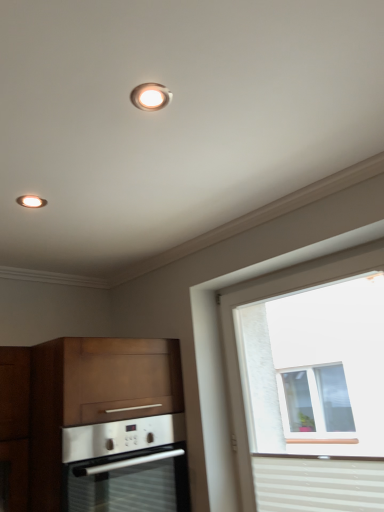
This screenshot has width=384, height=512. In order to click on satin silver oven at lower left in this screenshot , I will do `click(127, 465)`.

The height and width of the screenshot is (512, 384). Describe the element at coordinates (94, 425) in the screenshot. I see `wooden cabinet at lower left` at that location.

Identify the location of white striped curtain at lower right. (318, 483).

The width and height of the screenshot is (384, 512). I want to click on satin silver oven at lower left, so click(x=127, y=465).

Considering the relative positions of satin silver oven at lower left and matte white recessed light at upper center in the image provided, is satin silver oven at lower left to the right of matte white recessed light at upper center from the viewer's perspective?

In fact, satin silver oven at lower left is to the left of matte white recessed light at upper center.

Looking at the image, does satin silver oven at lower left seem bigger or smaller compared to matte white recessed light at upper center?

satin silver oven at lower left is bigger than matte white recessed light at upper center.

Is satin silver oven at lower left completely or partially outside of matte white recessed light at upper center?

That's correct, satin silver oven at lower left is outside of matte white recessed light at upper center.

Which object is further away from the camera, white striped curtain at lower right or matte white recessed light at upper center?

white striped curtain at lower right is further from the camera.

Is white striped curtain at lower right aimed at matte white recessed light at upper center?

No, white striped curtain at lower right does not turn towards matte white recessed light at upper center.

You are a GUI agent. You are given a task and a screenshot of the screen. Output one action in this format:
    pyautogui.click(x=<x>, y=<y>)
    Task: Click on the lighting on the left of white striped curtain at lower right
    
    Given the screenshot: What is the action you would take?
    pyautogui.click(x=150, y=96)

Which is more distant, (313, 458) or (139, 103)?

The point (313, 458) is farther.

Can you confirm if wooden cabinet at lower left is shorter than white striped curtain at lower right?

No, wooden cabinet at lower left is not shorter than white striped curtain at lower right.

Can you confirm if wooden cabinet at lower left is wider than white striped curtain at lower right?

Yes.

In the image, is wooden cabinet at lower left positioned in front of or behind white striped curtain at lower right?

Clearly, wooden cabinet at lower left is in front of white striped curtain at lower right.

Does white textured window at right touch white striped curtain at lower right?

white textured window at right and white striped curtain at lower right are not in contact.

Looking at this image, considering the relative positions of white textured window at right and white striped curtain at lower right in the image provided, is white textured window at right to the left or to the right of white striped curtain at lower right?

white textured window at right is to the right of white striped curtain at lower right.

The image size is (384, 512). What are the coordinates of `window above the white striped curtain at lower right (from a real-world perspective)` in the screenshot? It's located at (300, 355).

Which of these two, white textured window at right or white striped curtain at lower right, is wider?

Wider between the two is white textured window at right.

Does point (146, 96) appear closer or farther from the camera than point (270, 327)?

Point (146, 96) is positioned closer to the camera compared to point (270, 327).

Considering the relative sizes of matte white recessed light at upper center and white textured window at right in the image provided, is matte white recessed light at upper center wider than white textured window at right?

In fact, matte white recessed light at upper center might be narrower than white textured window at right.

From the image's perspective, which is above, matte white recessed light at upper center or white textured window at right?

matte white recessed light at upper center appears higher in the image.

Between matte white recessed light at upper center and white textured window at right, which one has less height?

With less height is matte white recessed light at upper center.

In the image, is wooden cabinet at lower left positioned in front of or behind matte white recessed light at upper center?

Visually, wooden cabinet at lower left is located behind matte white recessed light at upper center.

Which object is thinner, wooden cabinet at lower left or matte white recessed light at upper center?

With smaller width is matte white recessed light at upper center.

Which is farther, (30, 352) or (151, 88)?

The point (30, 352) is farther from the camera.

Would you say wooden cabinet at lower left is outside matte white recessed light at upper center?

wooden cabinet at lower left is positioned outside matte white recessed light at upper center.

At what (x,y) coordinates should I click in order to perform the action: click on cabinetry behind the matte white recessed light at upper center. Please return your answer as a coordinate pair (x, y). Image resolution: width=384 pixels, height=512 pixels. Looking at the image, I should click on (94, 425).

From a real-world perspective, which is physically above, matte white recessed light at upper center or wooden cabinet at lower left?

matte white recessed light at upper center is physically above.

How distant is matte white recessed light at upper center from wooden cabinet at lower left?

matte white recessed light at upper center and wooden cabinet at lower left are 1.27 meters apart.

Find the location of a particular element. lighting above the satin silver oven at lower left (from a real-world perspective) is located at coordinates (150, 96).

Identify the location of lighting to the left of white striped curtain at lower right. This screenshot has height=512, width=384. (150, 96).

Looking at the image, which one is located further to white striped curtain at lower right, wooden cabinet at lower left or white textured window at right?

white textured window at right.

Considering their positions, is satin silver oven at lower left positioned further to white striped curtain at lower right than wooden cabinet at lower left?

wooden cabinet at lower left is positioned further to the anchor white striped curtain at lower right.

Estimate the real-world distances between objects in this image. Which object is further from wooden cabinet at lower left, white striped curtain at lower right or satin silver oven at lower left?

white striped curtain at lower right lies further to wooden cabinet at lower left than the other object.

Which object lies further to the anchor point wooden cabinet at lower left, satin silver oven at lower left or white textured window at right?

Based on the image, white textured window at right appears to be further to wooden cabinet at lower left.

Based on the photo, estimate the real-world distances between objects in this image. Which object is closer to satin silver oven at lower left, white textured window at right or wooden cabinet at lower left?

wooden cabinet at lower left lies closer to satin silver oven at lower left than the other object.

When comparing their distances from white striped curtain at lower right, does white textured window at right or wooden cabinet at lower left seem further?

white textured window at right.

From the image, which object appears to be farther from white textured window at right, white striped curtain at lower right or matte white recessed light at upper center?

Among the two, matte white recessed light at upper center is located further to white textured window at right.

Considering their positions, is matte white recessed light at upper center positioned closer to white striped curtain at lower right than satin silver oven at lower left?

Result: Based on the image, satin silver oven at lower left appears to be nearer to white striped curtain at lower right.

Identify the location of oven situated between wooden cabinet at lower left and white striped curtain at lower right from left to right. Image resolution: width=384 pixels, height=512 pixels. (127, 465).

At what (x,y) coordinates should I click in order to perform the action: click on curtain between matte white recessed light at upper center and satin silver oven at lower left vertically. Please return your answer as a coordinate pair (x, y). Looking at the image, I should click on (318, 483).

Find the location of a particular element. window between matte white recessed light at upper center and satin silver oven at lower left in the vertical direction is located at coordinates (300, 355).

The width and height of the screenshot is (384, 512). In order to click on oven between wooden cabinet at lower left and white textured window at right in the horizontal direction in this screenshot , I will do `click(127, 465)`.